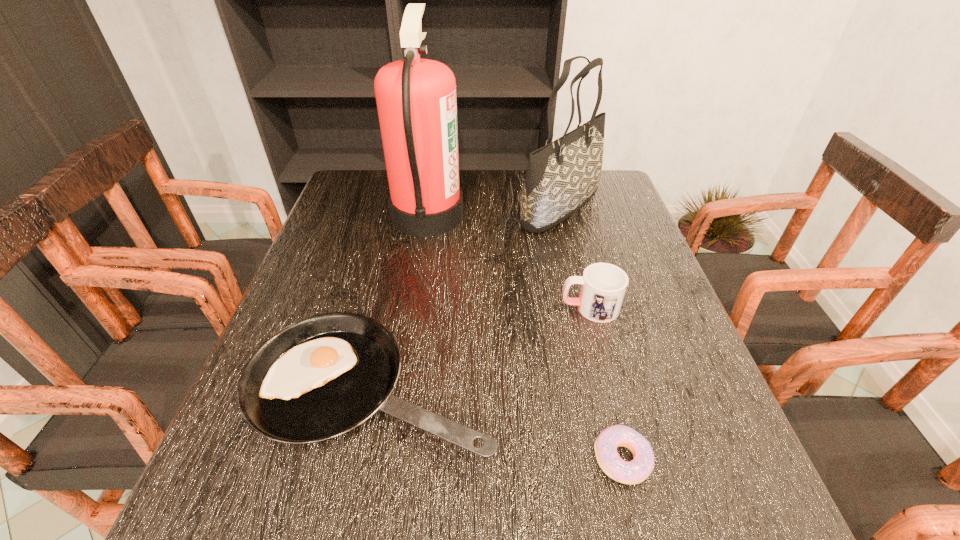
You are a GUI agent. You are given a task and a screenshot of the screen. Output one action in this format:
    pyautogui.click(x=<x>, y=<y>)
    Task: Click on the vacant space located 0.390m on the side of the third farthest object with the handle
    Image resolution: width=960 pixels, height=540 pixels.
    Given the screenshot: What is the action you would take?
    pyautogui.click(x=383, y=307)

In order to click on vacant space located 0.210m on the back of the frying pan in this screenshot , I will do pos(398,262).

Identify the location of free space located on the left of the shortest object. (527, 459).

Locate an element on the screen. fire extinguisher present at the far edge is located at coordinates (416, 101).

The width and height of the screenshot is (960, 540). I want to click on tote bag that is at the far edge, so click(x=561, y=177).

This screenshot has height=540, width=960. Find the location of `object positioned at the near edge`. object positioned at the near edge is located at coordinates (635, 471).

Locate an element on the screen. Image resolution: width=960 pixels, height=540 pixels. object present at the left edge is located at coordinates (322, 376).

Identify the location of tote bag that is at the right edge. (561, 177).

Identify the location of mug that is positioned at the right edge. This screenshot has height=540, width=960. (603, 285).

The image size is (960, 540). Identify the location of doughnut at the right edge. (635, 471).